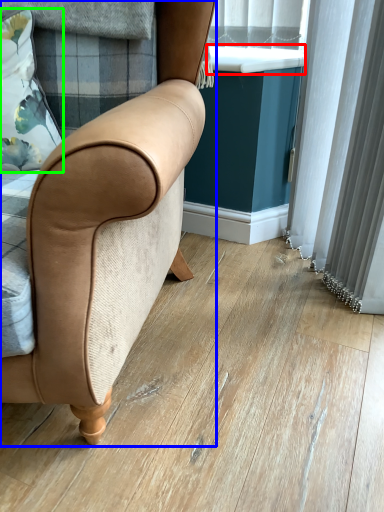
Question: Which is nearer to the window sill (highlighted by a red box)? chair (highlighted by a blue box) or pillow (highlighted by a green box).

Choices:
 (A) chair
 (B) pillow

Answer: (B)